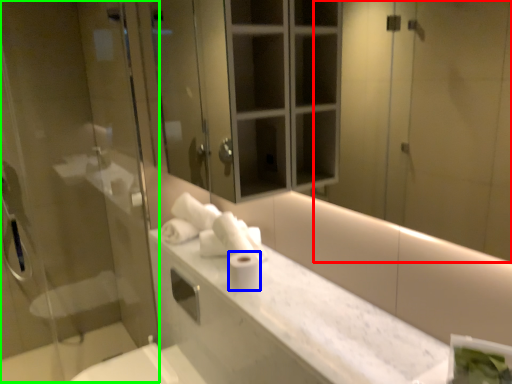
Question: Considering the real-world distances, which object is closest to mirror (highlighted by a red box)? toilet paper (highlighted by a blue box) or screen door (highlighted by a green box).

Choices:
 (A) toilet paper
 (B) screen door

Answer: (A)